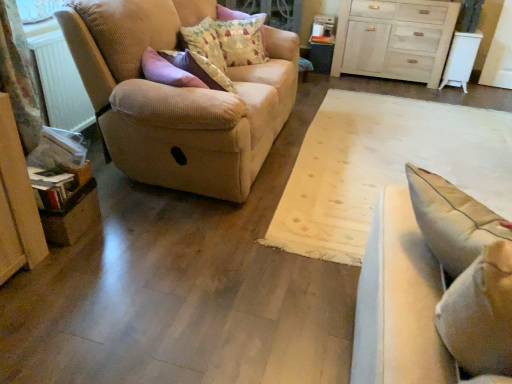
Question: Considering the positions of beige corduroy couch at left, which appears as the first studio couch when viewed from the left, and white plastic radiator at left in the image, is beige corduroy couch at left, which appears as the first studio couch when viewed from the left, bigger or smaller than white plastic radiator at left?

Choices:
 (A) small
 (B) big

Answer: (B)

Question: Is beige corduroy couch at left, which appears as the first studio couch when viewed from the left, spatially inside white plastic radiator at left, or outside of it?

Choices:
 (A) outside
 (B) inside

Answer: (A)

Question: Based on their relative distances, which object is farther from the patterned fabric pillow at upper center, which is the 2th pillow in front-to-back order?

Choices:
 (A) white plastic radiator at left
 (B) white wood chest of drawers at upper right
 (C) light beige fabric studio couch at right, acting as the first studio couch starting from the front
 (D) fluffy cotton pillow at upper center, arranged as the 1th pillow when viewed from the front
 (E) beige corduroy couch at left, which appears as the first studio couch when viewed from the left

Answer: (C)

Question: Estimate the real-world distances between objects in this image. Which object is closer to the patterned fabric pillow at upper center, which is the 2th pillow in front-to-back order?

Choices:
 (A) light beige fabric studio couch at right, positioned as the 2th studio couch in back-to-front order
 (B) fluffy cotton pillow at upper center, arranged as the 1th pillow when viewed from the front
 (C) beige corduroy couch at left, which is the second studio couch in front-to-back order
 (D) white plastic radiator at left
 (E) white wood chest of drawers at upper right

Answer: (B)